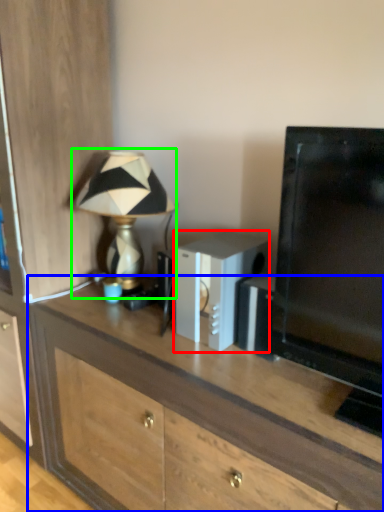
Question: Which is farther away from appliance (highlighted by a red box)? desk (highlighted by a blue box) or lamp (highlighted by a green box)?

Choices:
 (A) desk
 (B) lamp

Answer: (B)